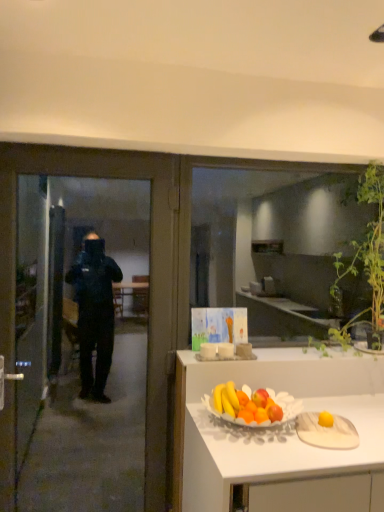
Identify the location of transparent glass window at center. (277, 247).

Where is `green leafy plant at upper right`? green leafy plant at upper right is located at coordinates (365, 260).

Locate an element on the screen. This screenshot has width=384, height=512. transparent glass window at center is located at coordinates (277, 247).

Which of these two, green leafy plant at upper right or transparent glass window at center, is wider?

green leafy plant at upper right.

Is green leafy plant at upper right not within transparent glass window at center?

Yes.

Identify the location of window above the green leafy plant at upper right (from the image's perspective). (277, 247).

Is point (155, 159) closer or farther from the camera than point (380, 176)?

Point (155, 159) is closer to the camera than point (380, 176).

From the image's perspective, is transparent glass door at left positioned above or below green leafy plant at upper right?

From the image's perspective, transparent glass door at left appears below green leafy plant at upper right.

How many degrees apart are the facing directions of transparent glass door at left and green leafy plant at upper right?

The facing directions of transparent glass door at left and green leafy plant at upper right are 0.00133 degrees apart.

Between transparent glass door at left and green leafy plant at upper right, which one appears on the left side from the viewer's perspective?

From the viewer's perspective, transparent glass door at left appears more on the left side.

Which object is thinner, transparent glass window at center or green leafy plant at upper right?

Thinner between the two is transparent glass window at center.

Can you confirm if transparent glass window at center is positioned to the left of green leafy plant at upper right?

Indeed, transparent glass window at center is positioned on the left side of green leafy plant at upper right.

Does point (299, 251) lie in front of point (370, 314)?

No, it is behind (370, 314).

Does transparent glass window at center turn towards transparent glass door at left?

No, transparent glass window at center is not aimed at transparent glass door at left.

Considering the relative sizes of transparent glass window at center and transparent glass door at left in the image provided, is transparent glass window at center wider than transparent glass door at left?

Incorrect, the width of transparent glass window at center does not surpass that of transparent glass door at left.

Is transparent glass window at center surrounding transparent glass door at left?

Definitely not — transparent glass door at left is not inside transparent glass window at center.

Does transparent glass window at center have a smaller size compared to transparent glass door at left?

Yes.

Is transparent glass door at left far from transparent glass window at center?

Yes, transparent glass door at left is far from transparent glass window at center.

Is point (146, 177) positioned in front of point (326, 188)?

Yes, point (146, 177) is closer to viewer.

From the picture: From a real-world perspective, which object stands above the other?

transparent glass window at center is physically above.

From a real-world perspective, is green leafy plant at upper right above or below transparent glass door at left?

In terms of real-world spatial position, green leafy plant at upper right is above transparent glass door at left.

What's the angular difference between green leafy plant at upper right and transparent glass door at left's facing directions?

They differ by 0.00133 degrees in their facing directions.

Is there a large distance between green leafy plant at upper right and transparent glass door at left?

Indeed, green leafy plant at upper right is not near transparent glass door at left.

Is green leafy plant at upper right at the left side of transparent glass door at left?

In fact, green leafy plant at upper right is to the right of transparent glass door at left.

At what (x,y) coordinates should I click in order to perform the action: click on plant in front of the transparent glass window at center. Please return your answer as a coordinate pair (x, y). The width and height of the screenshot is (384, 512). Looking at the image, I should click on (365, 260).

Where is `plant positioned vertically above the transparent glass door at left (from a real-world perspective)`? The width and height of the screenshot is (384, 512). plant positioned vertically above the transparent glass door at left (from a real-world perspective) is located at coordinates pos(365,260).

When comparing their distances from green leafy plant at upper right, does transparent glass window at center or transparent glass door at left seem closer?

Among the two, transparent glass door at left is located nearer to green leafy plant at upper right.

Which object lies further to the anchor point transparent glass window at center, transparent glass door at left or green leafy plant at upper right?

transparent glass door at left lies further to transparent glass window at center than the other object.

From the image, which object appears to be farther from transparent glass door at left, transparent glass window at center or green leafy plant at upper right?

transparent glass window at center lies further to transparent glass door at left than the other object.

Based on their spatial positions, is green leafy plant at upper right or transparent glass window at center further from transparent glass door at left?

Based on the image, transparent glass window at center appears to be further to transparent glass door at left.

From the image, which object appears to be nearer to green leafy plant at upper right, transparent glass door at left or transparent glass window at center?

transparent glass door at left.

Which object lies further to the anchor point transparent glass window at center, green leafy plant at upper right or transparent glass door at left?

Based on the image, transparent glass door at left appears to be further to transparent glass window at center.

At what (x,y) coordinates should I click in order to perform the action: click on window situated between transparent glass door at left and green leafy plant at upper right from left to right. Please return your answer as a coordinate pair (x, y). This screenshot has height=512, width=384. Looking at the image, I should click on (277, 247).